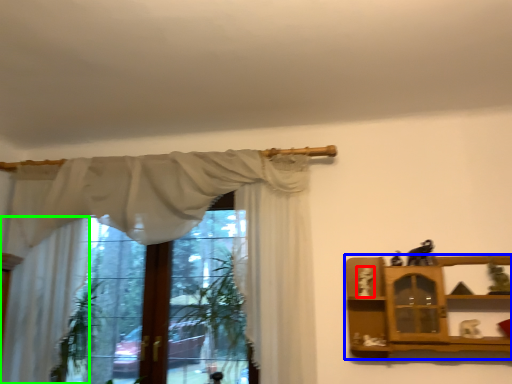
Question: Based on their relative distances, which object is nearer to toy (highlighted by a red box)? Choose from shelf (highlighted by a blue box) and curtain (highlighted by a green box).

Choices:
 (A) shelf
 (B) curtain

Answer: (A)